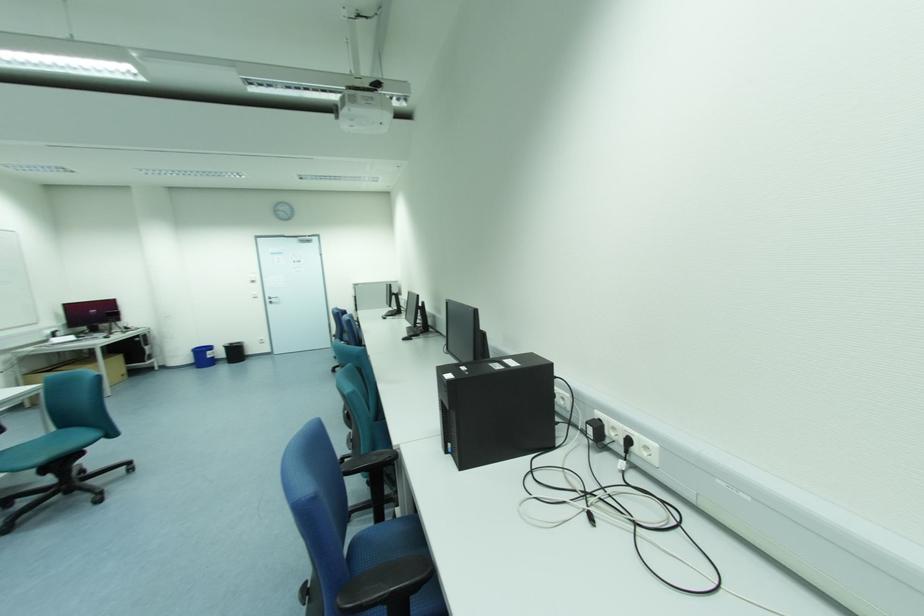
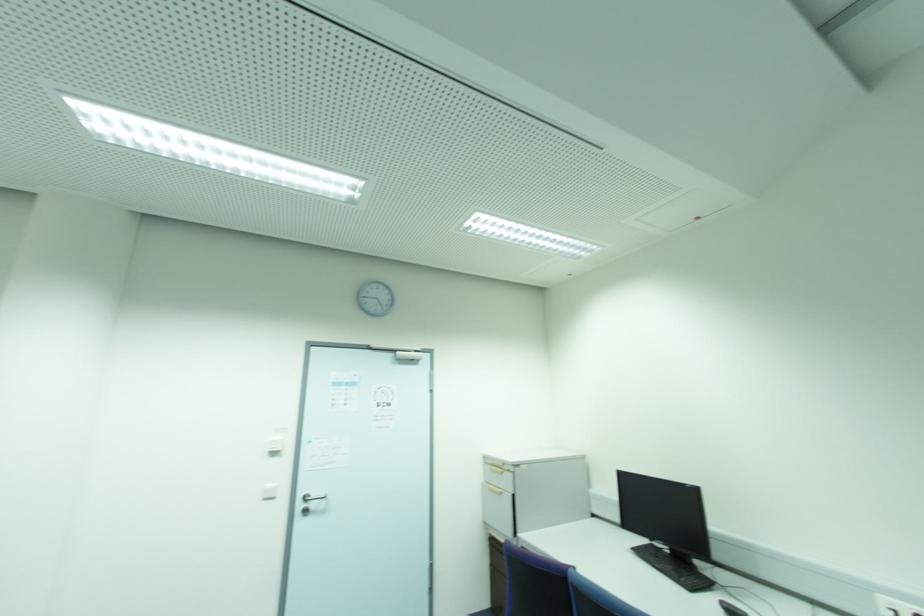
Locate, in the second image, the point that corresponds to the point at 253,282 in the first image.

(274, 454)